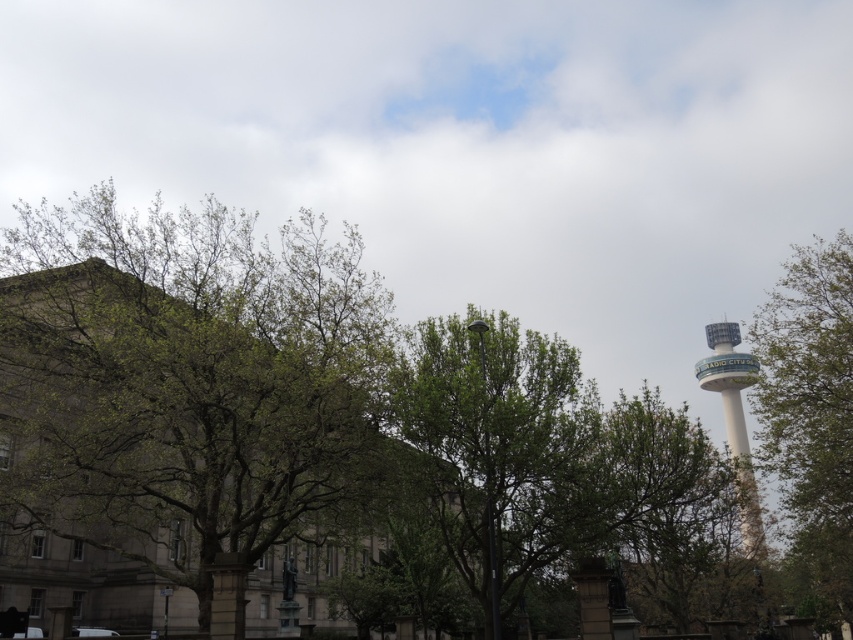
Does green leafy tree at center lie in front of white concrete tower at right?

Yes, it is.

Is green leafy tree at center to the left of white concrete tower at right from the viewer's perspective?

Yes, green leafy tree at center is to the left of white concrete tower at right.

This screenshot has height=640, width=853. What do you see at coordinates (538, 452) in the screenshot? I see `green leafy tree at center` at bounding box center [538, 452].

In order to click on green leafy tree at center in this screenshot , I will do `click(538, 452)`.

Does green leafy tree at right appear on the right side of white concrete tower at right?

Yes, green leafy tree at right is to the right of white concrete tower at right.

Is the position of green leafy tree at right less distant than that of white concrete tower at right?

That is False.

The width and height of the screenshot is (853, 640). What do you see at coordinates (810, 417) in the screenshot?
I see `green leafy tree at right` at bounding box center [810, 417].

The width and height of the screenshot is (853, 640). In order to click on green leafy tree at right in this screenshot , I will do [x=810, y=417].

Consider the image. Which of these two, green leafy tree at center or green leafy tree at right, stands shorter?

green leafy tree at center

Which is below, green leafy tree at center or green leafy tree at right?

green leafy tree at center is below.

Find the location of a particular element. green leafy tree at center is located at coordinates (538, 452).

Locate an element on the screen. green leafy tree at center is located at coordinates (538, 452).